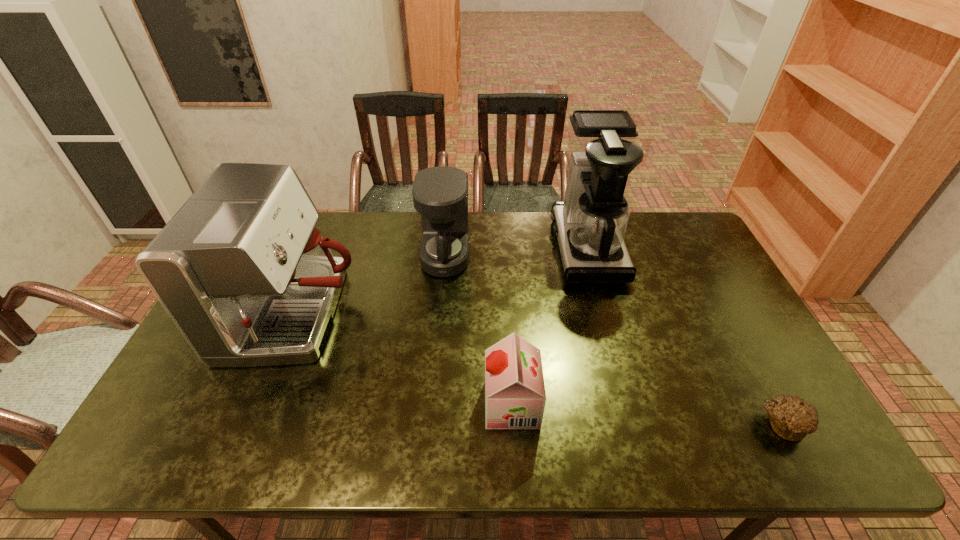
You are a GUI agent. You are given a task and a screenshot of the screen. Output one action in this format:
    pyautogui.click(x=<x>, y=<y>)
    Task: Click on the vacant space located 0.090m at the front of the fourth object from left to right where the controls are located
    
    Given the screenshot: What is the action you would take?
    pyautogui.click(x=528, y=247)

Find the location of a particular element. This screenshot has height=540, width=960. free space located 0.310m on the front of the leftmost coffee maker near the spout is located at coordinates (466, 315).

At what (x,y) coordinates should I click in order to perform the action: click on vacant space located 0.150m on the button side of the second coffee maker from left to right. Please return your answer as a coordinate pair (x, y). Looking at the image, I should click on (515, 257).

Find the location of a particular element. This screenshot has height=540, width=960. vacant space positioned 0.300m with the cap open on the third object from right to left is located at coordinates (363, 404).

Find the location of a particular element. This screenshot has width=960, height=540. vacant space located 0.050m with the cap open on the third object from right to left is located at coordinates (465, 404).

You are a GUI agent. You are given a task and a screenshot of the screen. Output one action in this format:
    pyautogui.click(x=<x>, y=<y>)
    Task: Click on the vacant space located 0.320m with the cap open on the third object from right to left
    Image resolution: width=960 pixels, height=540 pixels.
    Given the screenshot: What is the action you would take?
    pyautogui.click(x=355, y=404)

This screenshot has height=540, width=960. Find the location of `vacant space located 0.310m on the back of the shortest object`. vacant space located 0.310m on the back of the shortest object is located at coordinates (722, 312).

The width and height of the screenshot is (960, 540). I want to click on soya milk present at the near edge, so click(x=515, y=397).

The width and height of the screenshot is (960, 540). What are the coordinates of `muffin that is at the near edge` in the screenshot? It's located at (792, 418).

Where is `object that is at the left edge`? The width and height of the screenshot is (960, 540). object that is at the left edge is located at coordinates (248, 280).